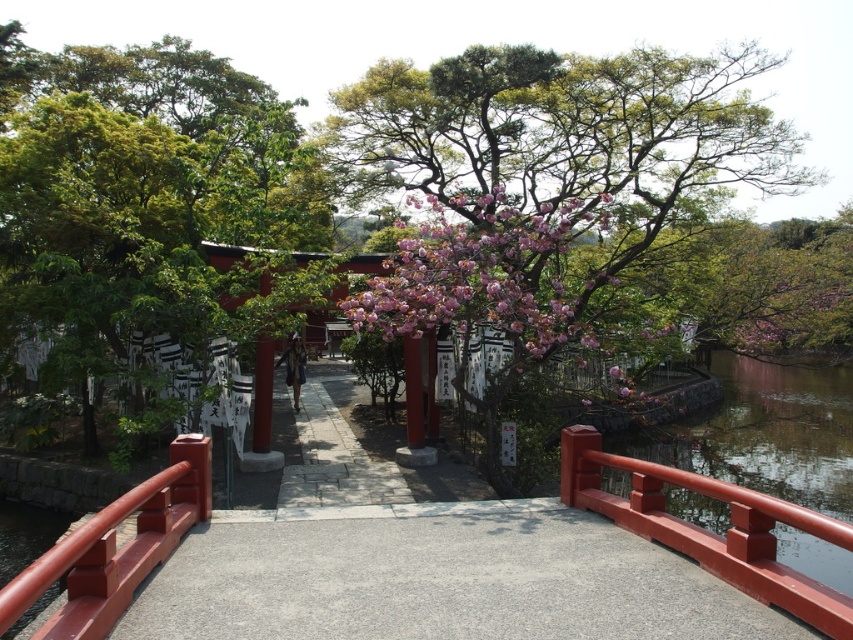
You are a visitor at a Shinto shrine and want to take a photo of the smooth glossy wood rail at right and the smooth red railing at lower left. To ensure both are in the frame, which railing should you position closer to the camera?

The smooth glossy wood rail at right is positioned over the smooth red railing at lower left, so you should position the smooth glossy wood rail at right closer to the camera to include both in the frame.

From the picture: You are standing at the entrance of the shrine and see the red torii gate in the background. There is a point marked at coordinates (141, 186). Based on the scene description, what object or feature is located at this point?

The point at coordinates (141, 186) corresponds to the pink blossoming tree at center.

You are a visitor approaching the torii gate and notice a pink blossoming tree at center and a smooth red railing at lower left. From your perspective, which object is higher in the image?

The pink blossoming tree at center is above the smooth red railing at lower left, so the pink blossoming tree at center is higher in the image.